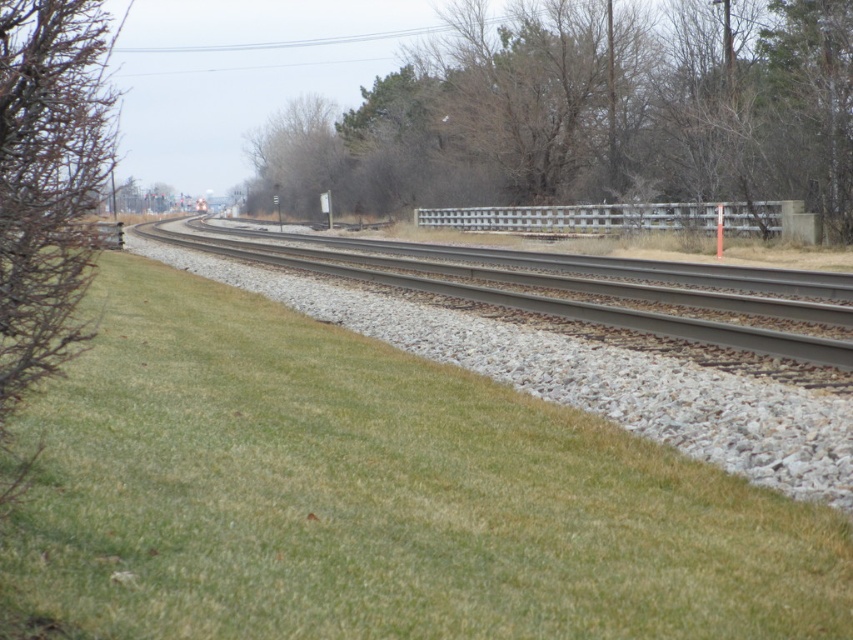
Question: Does green grassy at center lie behind bare branches at center?

Choices:
 (A) yes
 (B) no

Answer: (B)

Question: Which of the following is the closest to the observer?

Choices:
 (A) bare branches at center
 (B) gray metallic tracks at center
 (C) green grassy at center
 (D) brown textured bush at left

Answer: (D)

Question: Can you confirm if green grassy at center is positioned to the left of bare branches at center?

Choices:
 (A) yes
 (B) no

Answer: (B)

Question: Which of the following is the farthest from the observer?

Choices:
 (A) green grassy at center
 (B) gray metallic tracks at center

Answer: (B)

Question: Is bare branches at center positioned in front of brown textured bush at left?

Choices:
 (A) yes
 (B) no

Answer: (B)

Question: Which of the following is the closest to the observer?

Choices:
 (A) (68, 3)
 (B) (764, 129)

Answer: (A)